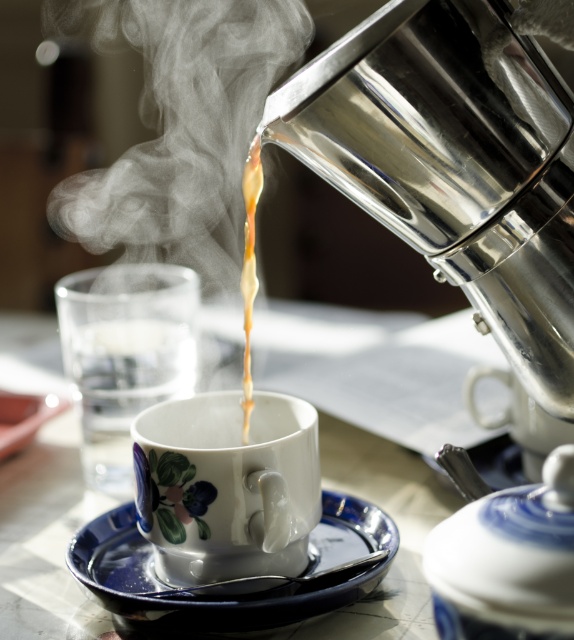
From the picture: You are holding a spoon and want to stir the coffee in the ceramic cup with floral design. The spoon is currently at point (164, 454) and the cup is at point (552, 621). Which point is closer to you so you can reach it first?

Point (164, 454) is closer to you than point (552, 621), so you can reach it first.

You are a barista preparing a coffee order. You have a porcelain floral cup at center and a brown glossy liquid at center. Which object would you need to fill first before serving?

The porcelain floral cup at center must be filled first with the brown glossy liquid at center because the cup is larger in size than the liquid, allowing it to hold the beverage properly.